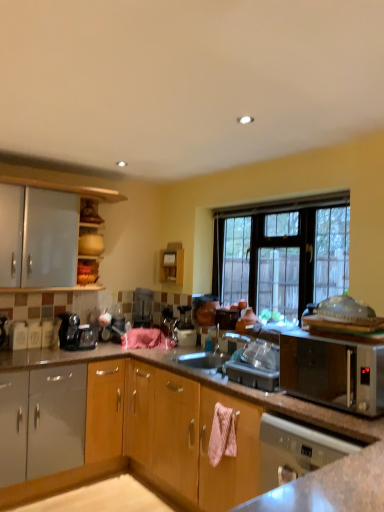
Identify the location of metallic silver toaster at center. This screenshot has width=384, height=512. (142, 307).

Identify the location of satin silver dishwasher at lower right. coord(295,450).

The image size is (384, 512). Describe the element at coordinates (295, 450) in the screenshot. I see `satin silver dishwasher at lower right` at that location.

In order to click on black plastic coffee machine at left in this screenshot , I will do `click(75, 333)`.

Can you tell me how much black glass window at center and satin silver dishwasher at lower right differ in facing direction?

The angle between the facing direction of black glass window at center and the facing direction of satin silver dishwasher at lower right is 1.95 degrees.

Is black glass window at center facing away from satin silver dishwasher at lower right?

No.

Is point (279, 247) positioned before point (294, 445)?

No, it is not.

Is black glass window at center wider than satin silver dishwasher at lower right?

No, black glass window at center is not wider than satin silver dishwasher at lower right.

Is point (77, 326) farther from viewer compared to point (140, 312)?

No, it is not.

Is black plastic coffee machine at left aimed at metallic silver toaster at center?

No, black plastic coffee machine at left is not oriented towards metallic silver toaster at center.

Who is taller, black plastic coffee machine at left or metallic silver toaster at center?

With more height is metallic silver toaster at center.

Can you confirm if satin silver dishwasher at lower right is thinner than black plastic coffee machine at left?

No.

Is satin silver dishwasher at lower right not near black plastic coffee machine at left?

satin silver dishwasher at lower right is far away from black plastic coffee machine at left.

From a real-world perspective, is satin silver dishwasher at lower right above or below black plastic coffee machine at left?

satin silver dishwasher at lower right is below black plastic coffee machine at left.

You are a GUI agent. You are given a task and a screenshot of the screen. Output one action in this format:
    pyautogui.click(x=<x>, y=<y>)
    Task: Click on the coffee machine above the satin silver dishwasher at lower right (from the image's perspective)
    The image size is (384, 512).
    Given the screenshot: What is the action you would take?
    pyautogui.click(x=75, y=333)

From a real-world perspective, is black glass window at center physically located above or below silver metallic microwave at right?

black glass window at center is situated higher than silver metallic microwave at right in the real world.

Which point is more forward, (295, 211) or (354, 406)?

The point (354, 406) is closer to the camera.

Considering the sizes of black glass window at center and silver metallic microwave at right in the image, is black glass window at center wider or thinner than silver metallic microwave at right?

Clearly, black glass window at center has less width compared to silver metallic microwave at right.

In the scene shown: Is silver metallic microwave at right at the back of black glass window at center?

No, black glass window at center is not facing the opposite direction of silver metallic microwave at right.

Considering the positions of point (144, 290) and point (65, 323), is point (144, 290) closer or farther from the camera than point (65, 323)?

Point (144, 290) is farther from the camera than point (65, 323).

Which of these two, metallic silver toaster at center or black plastic coffee machine at left, stands shorter?

Standing shorter between the two is black plastic coffee machine at left.

Does metallic silver toaster at center lie in front of black plastic coffee machine at left?

No, the depth of metallic silver toaster at center is greater than that of black plastic coffee machine at left.

Is there a large distance between silver metallic microwave at right and satin silver dishwasher at lower right?

silver metallic microwave at right is positioned a significant distance from satin silver dishwasher at lower right.

From the picture: How different are the orientations of silver metallic microwave at right and satin silver dishwasher at lower right in degrees?

0.00171 degrees separate the facing orientations of silver metallic microwave at right and satin silver dishwasher at lower right.

Which object is closer to the camera taking this photo, silver metallic microwave at right or satin silver dishwasher at lower right?

satin silver dishwasher at lower right is in front.

Is point (331, 388) positioned after point (264, 459)?

Yes, point (331, 388) is farther from viewer.

From the image's perspective, is metallic silver toaster at center on top of silver metallic microwave at right?

Yes.

Is point (152, 300) in front of point (332, 353)?

No, it is not.

In terms of height, does metallic silver toaster at center look taller or shorter compared to silver metallic microwave at right?

metallic silver toaster at center is taller than silver metallic microwave at right.

Looking at this image, is metallic silver toaster at center positioned far away from silver metallic microwave at right?

metallic silver toaster at center is far away from silver metallic microwave at right.

Find the location of a particular element. This screenshot has width=384, height=512. window lying behind the satin silver dishwasher at lower right is located at coordinates (282, 252).

Identify the location of coffee machine on the left of metallic silver toaster at center. (75, 333).

Considering their positions, is metallic silver toaster at center positioned closer to satin silver dishwasher at lower right than black plastic coffee machine at left?

black plastic coffee machine at left is positioned closer to the anchor satin silver dishwasher at lower right.

Based on their spatial positions, is satin silver dishwasher at lower right or silver metallic microwave at right further from black plastic coffee machine at left?

silver metallic microwave at right is further to black plastic coffee machine at left.

Looking at this image, estimate the real-world distances between objects in this image. Which object is further from metallic silver toaster at center, satin silver dishwasher at lower right or black plastic coffee machine at left?

Based on the image, satin silver dishwasher at lower right appears to be further to metallic silver toaster at center.

Considering their positions, is black glass window at center positioned closer to metallic silver toaster at center than silver metallic microwave at right?

Based on the image, black glass window at center appears to be nearer to metallic silver toaster at center.

From the image, which object appears to be nearer to metallic silver toaster at center, satin silver dishwasher at lower right or silver metallic microwave at right?

Among the two, silver metallic microwave at right is located nearer to metallic silver toaster at center.

Based on their spatial positions, is black plastic coffee machine at left or metallic silver toaster at center further from satin silver dishwasher at lower right?

metallic silver toaster at center.

When comparing their distances from satin silver dishwasher at lower right, does black plastic coffee machine at left or silver metallic microwave at right seem further?

Among the two, silver metallic microwave at right is located further to satin silver dishwasher at lower right.

Based on their spatial positions, is satin silver dishwasher at lower right or black glass window at center further from silver metallic microwave at right?

satin silver dishwasher at lower right is positioned further to the anchor silver metallic microwave at right.

This screenshot has width=384, height=512. I want to click on coffee machine between satin silver dishwasher at lower right and metallic silver toaster at center along the z-axis, so click(x=75, y=333).

The image size is (384, 512). Find the location of `home appliance between black plastic coffee machine at left and silver metallic microwave at right from left to right`. home appliance between black plastic coffee machine at left and silver metallic microwave at right from left to right is located at coordinates (295, 450).

Locate an element on the screen. The width and height of the screenshot is (384, 512). window located between silver metallic microwave at right and metallic silver toaster at center in the depth direction is located at coordinates pyautogui.click(x=282, y=252).

Locate an element on the screen. microwave oven located between satin silver dishwasher at lower right and black glass window at center in the depth direction is located at coordinates (333, 373).